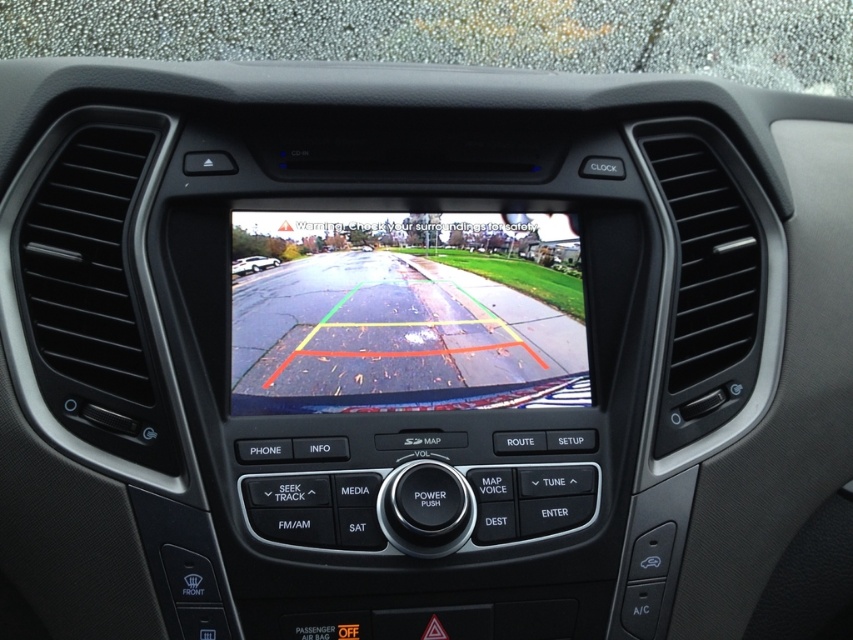
From the picture: Is the position of transparent plastic view mirror at center more distant than that of white glossy car at center?

That is False.

Is point (251, 298) behind point (241, 260)?

That is False.

In order to click on transparent plastic view mirror at center in this screenshot , I will do `click(407, 314)`.